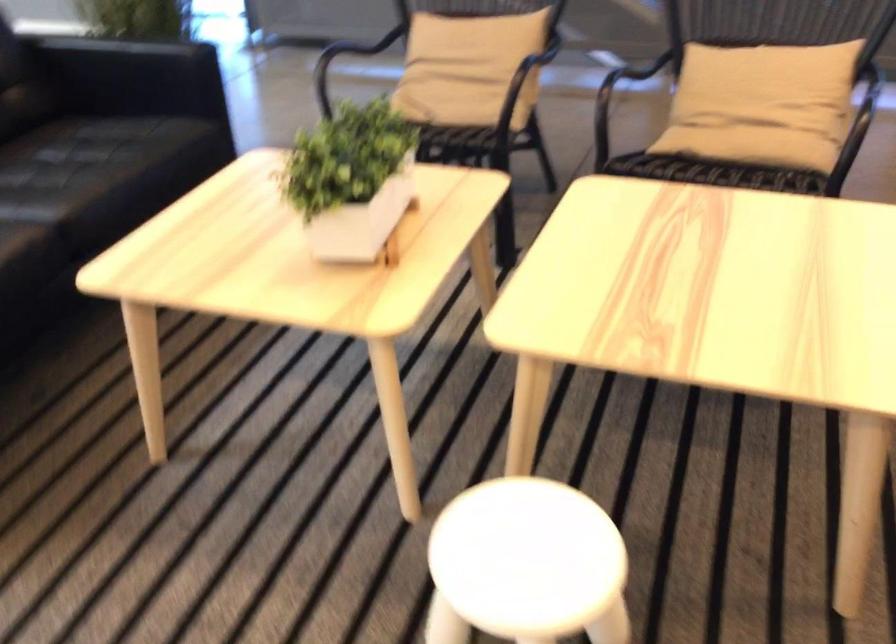
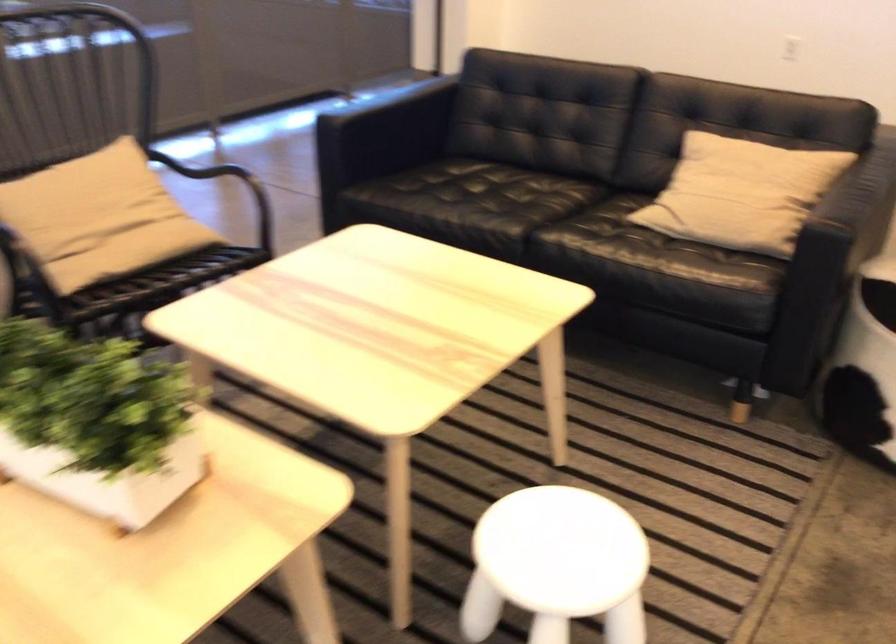
Find the pixel in the second image that matches (323,176) in the first image.

(96, 422)